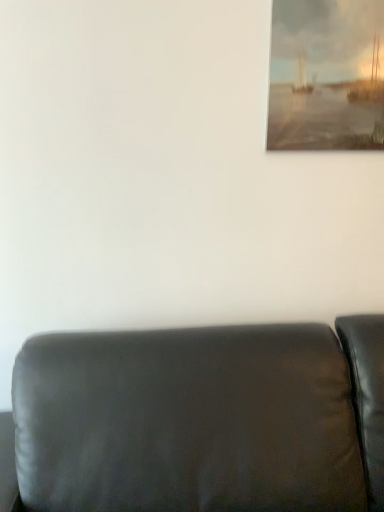
Describe the element at coordinates (199, 420) in the screenshot. I see `matte black couch at lower center` at that location.

The width and height of the screenshot is (384, 512). In order to click on matte black couch at lower center in this screenshot , I will do `click(199, 420)`.

Locate an element on the screen. matte black couch at lower center is located at coordinates (199, 420).